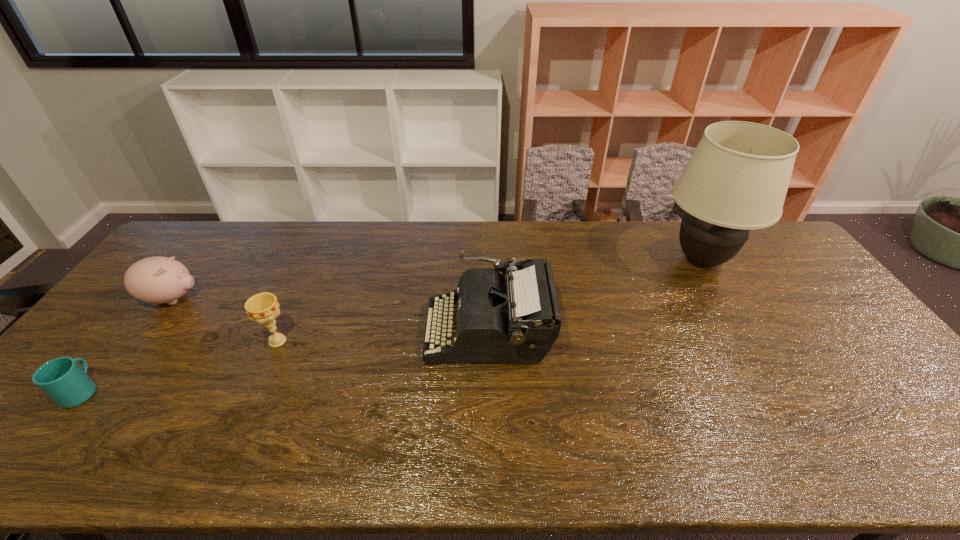
The height and width of the screenshot is (540, 960). Find the location of `vacant space that is in between the third object from right to left and the shortest object`. vacant space that is in between the third object from right to left and the shortest object is located at coordinates (180, 366).

Find the location of `free space between the fourth shortest object and the lampshade`. free space between the fourth shortest object and the lampshade is located at coordinates (595, 295).

Where is `vacant area between the cup and the tallest object`? This screenshot has height=540, width=960. vacant area between the cup and the tallest object is located at coordinates (392, 326).

You are a GUI agent. You are given a task and a screenshot of the screen. Output one action in this format:
    pyautogui.click(x=<x>, y=<y>)
    Task: Click on the object that is the second nearest to the typewriter
    The image size is (960, 540).
    Given the screenshot: What is the action you would take?
    pyautogui.click(x=737, y=178)

What are the coordinates of `object that is the fourth closest to the chalice` in the screenshot? It's located at (737, 178).

Locate an element on the screen. The width and height of the screenshot is (960, 540). vacant space that satisfies the following two spatial constraints: 1. on the handle side of the rightmost object; 2. on the right side of the cup is located at coordinates (185, 261).

You are a GUI agent. You are given a task and a screenshot of the screen. Output one action in this format:
    pyautogui.click(x=<x>, y=<y>)
    Task: Click on the blank space that satisfies the following two spatial constraints: 1. on the handle side of the shortest object; 2. on the right side of the third object from left to right
    The image size is (960, 540).
    Given the screenshot: What is the action you would take?
    pyautogui.click(x=121, y=341)

Find the location of `vacant area in the image that satisfies the following two spatial constraints: 1. on the handle side of the cup; 2. on the right side of the third object from right to left`. vacant area in the image that satisfies the following two spatial constraints: 1. on the handle side of the cup; 2. on the right side of the third object from right to left is located at coordinates (121, 341).

Where is `vacant point that satisfies the following two spatial constraints: 1. on the handle side of the shortest object; 2. on the left side of the rightmost object`? The width and height of the screenshot is (960, 540). vacant point that satisfies the following two spatial constraints: 1. on the handle side of the shortest object; 2. on the left side of the rightmost object is located at coordinates (185, 261).